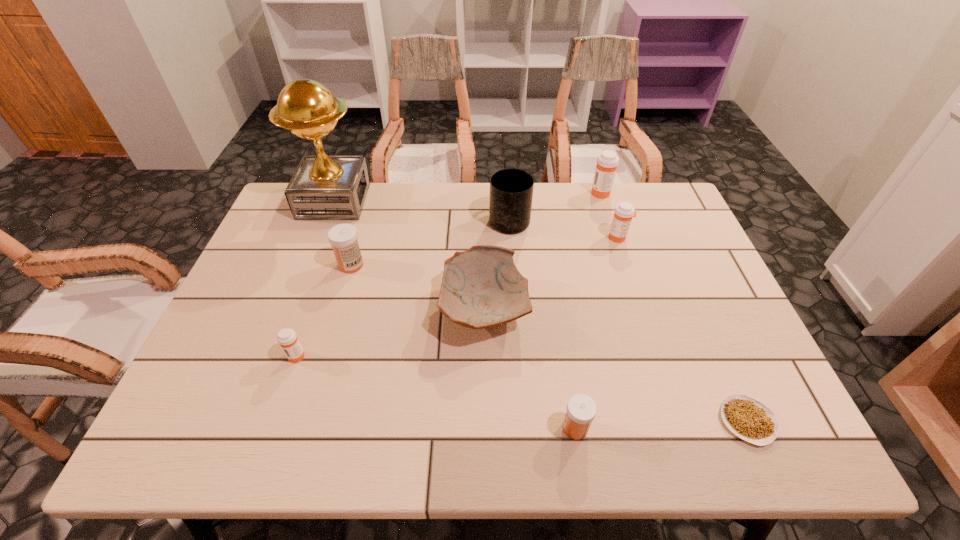
Where is `the leftmost orange medicine`? The height and width of the screenshot is (540, 960). the leftmost orange medicine is located at coordinates (287, 338).

At what (x,y) coordinates should I click in order to perform the action: click on the nearest orange medicine. Please return your answer as a coordinate pair (x, y). The height and width of the screenshot is (540, 960). Looking at the image, I should click on (287, 338).

Where is `the smaller white medicine`? The image size is (960, 540). the smaller white medicine is located at coordinates (581, 409).

Identify the location of the right white medicine. The image size is (960, 540). (581, 409).

Find the location of a particular element. This screenshot has height=540, width=960. legume is located at coordinates (748, 418).

At what (x,y) coordinates should I click in order to perform the action: click on the rightmost object. Please return your answer as a coordinate pair (x, y). Image resolution: width=960 pixels, height=540 pixels. Looking at the image, I should click on (748, 418).

Locate an element on the screen. This screenshot has height=540, width=960. free space located 0.310m on the front-facing side of the award is located at coordinates (461, 201).

The image size is (960, 540). I want to click on free space located 0.070m on the side of the mug with the handle, so click(x=507, y=190).

Image resolution: width=960 pixels, height=540 pixels. Find the location of `vacant area located 0.060m on the side of the mug with the handle`. vacant area located 0.060m on the side of the mug with the handle is located at coordinates (507, 192).

Image resolution: width=960 pixels, height=540 pixels. In order to click on vacant space located 0.180m on the right of the biggest orange medicine in this screenshot , I will do `click(663, 193)`.